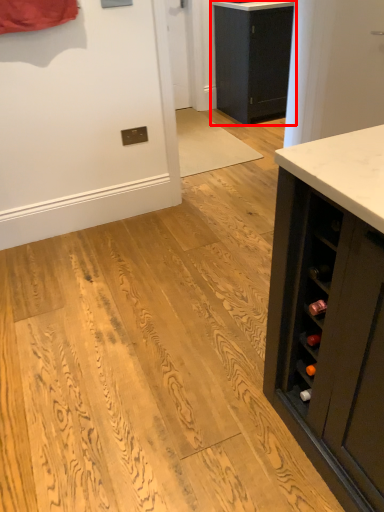
Question: From the image's perspective, considering the relative positions of cabinetry (annotated by the red box) and counter top in the image provided, where is cabinetry (annotated by the red box) located with respect to the staircase?

Choices:
 (A) above
 (B) below

Answer: (B)